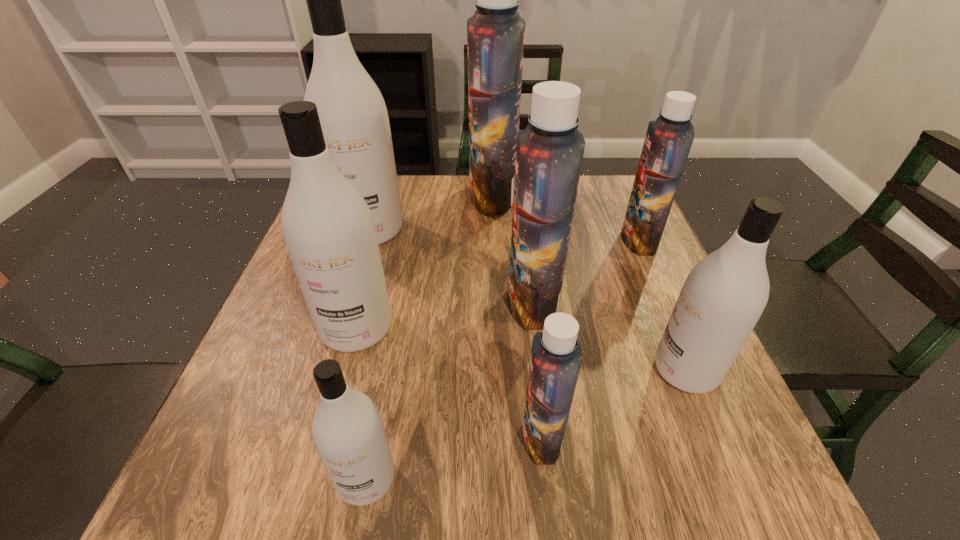
The height and width of the screenshot is (540, 960). I want to click on free region located on the front label of the farthest blue shampoo, so click(344, 197).

At what (x,y) coordinates should I click in order to perform the action: click on free point located 0.200m on the front label of the farthest blue shampoo. Please return your answer as a coordinate pair (x, y). Looking at the image, I should click on (399, 197).

In order to click on vacant point located on the front-facing side of the biggest white shampoo in this screenshot , I will do `click(355, 277)`.

I want to click on vacant space located on the front label of the second nearest blue shampoo, so click(x=340, y=302).

You are a GUI agent. You are given a task and a screenshot of the screen. Output one action in this format:
    pyautogui.click(x=<x>, y=<y>)
    Task: Click on the free spot located 0.120m on the front label of the second nearest blue shampoo
    The height and width of the screenshot is (540, 960).
    Given the screenshot: What is the action you would take?
    pyautogui.click(x=451, y=302)

Identify the location of free region located 0.310m on the front label of the second nearest blue shampoo. (363, 302).

Find the location of `free space located on the front-facing side of the third smallest white shampoo`. free space located on the front-facing side of the third smallest white shampoo is located at coordinates (311, 493).

In order to click on free region located on the front label of the rightmost blue shampoo in this screenshot , I will do `click(498, 240)`.

Image resolution: width=960 pixels, height=540 pixels. Identify the location of vacant area located 0.220m on the front label of the rightmost blue shampoo. (534, 240).

The image size is (960, 540). What are the coordinates of `free location located on the front label of the rightmost blue shampoo` in the screenshot? It's located at (511, 240).